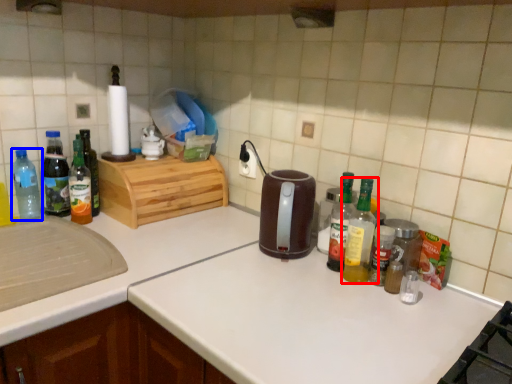
Question: Which object appears closest to the camera in this image, bottle (highlighted by a red box) or bottle (highlighted by a blue box)?

Choices:
 (A) bottle
 (B) bottle

Answer: (A)